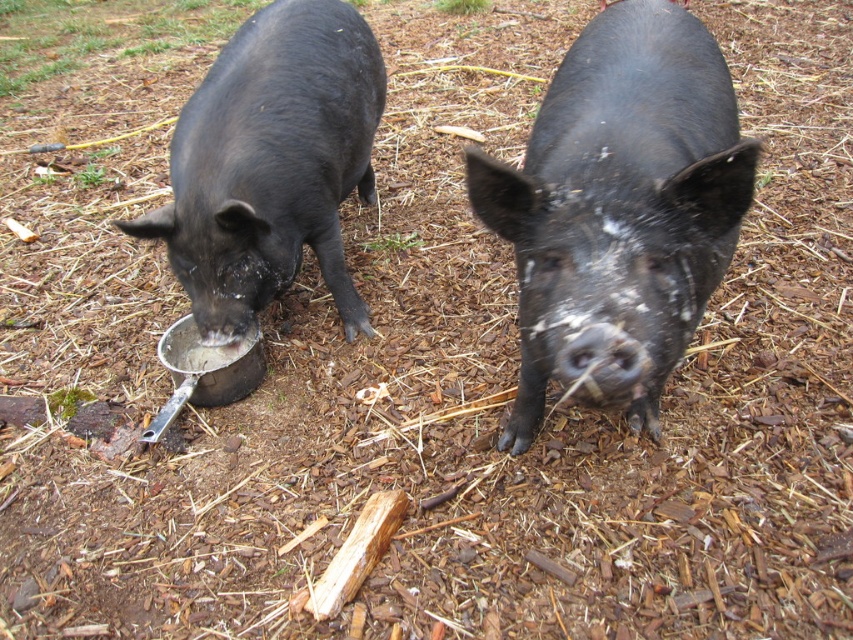
Measure the distance from black matte pig at center to shiny black pig at center.

black matte pig at center and shiny black pig at center are 36.49 inches apart from each other.

Which is behind, point (679, 154) or point (341, 252)?

Positioned behind is point (341, 252).

Does point (636, 180) come farther from viewer compared to point (247, 49)?

That is False.

I want to click on black matte pig at center, so click(619, 211).